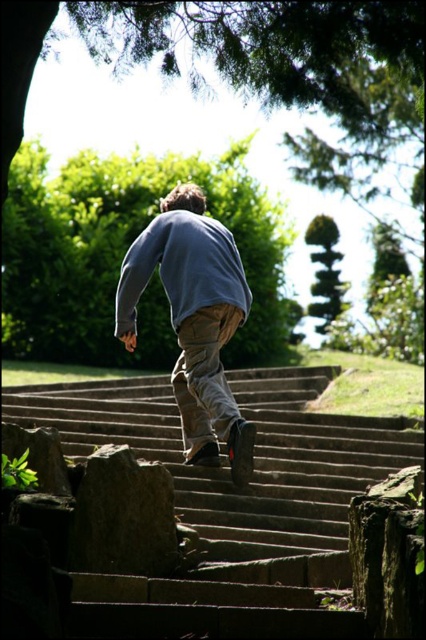
From the picture: You are standing at the bottom of the stone stairs at center. If you walk straight ahead, will you stay on the stairs or step onto the grass?

Since the stone stairs at center are located at point (232, 502), walking straight ahead from the bottom would keep you on the stairs rather than stepping onto the grass.

You are standing at the point labeled as point (178, 305) in the park. If you want to take a photo of the stone steps from a distance of 16.24 meters, where should you position yourself?

You should position yourself at the camera location because the point (178, 305) and the camera are 16.24 meters apart, meaning the camera is exactly 16.24 meters away from the point, which is the required distance for taking the photo.